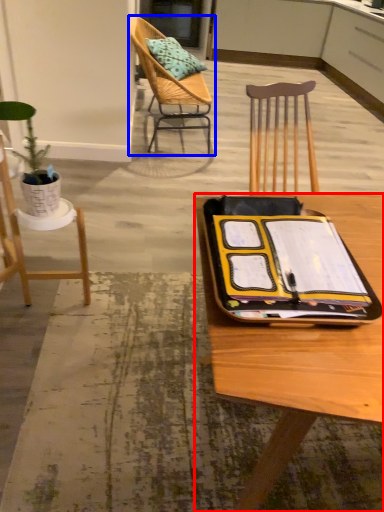
Question: Which of the following is the farthest to the observer, desk (highlighted by a red box) or chair (highlighted by a blue box)?

Choices:
 (A) desk
 (B) chair

Answer: (B)